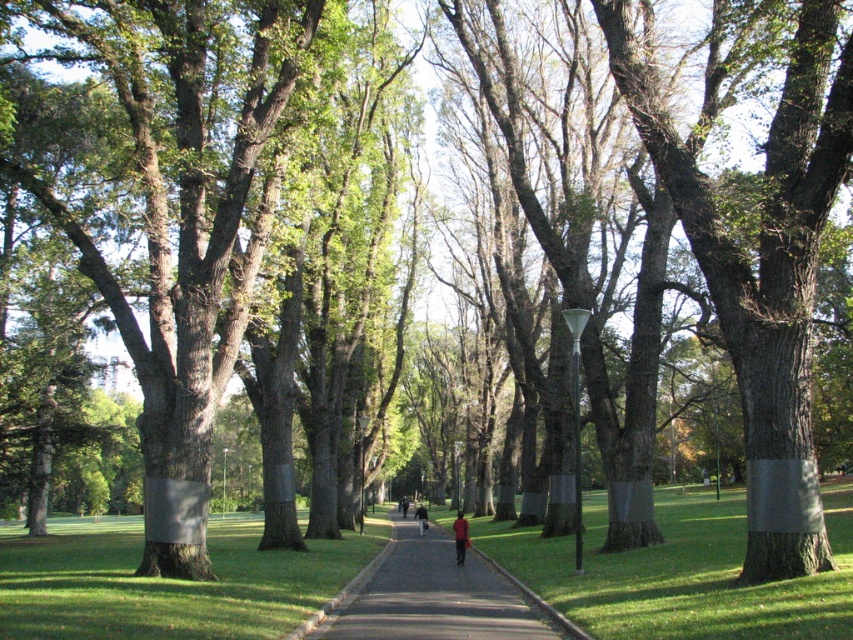
You are standing at the starting point of the pathway in the park. You want to walk towards the distant people. Which point, point (460,561) or point (422,531), will you reach first?

Point (460,561) is closer to the viewer than point (422,531), so you will reach point (460,561) first.

You are standing at the center of the park pathway. You see a smooth gray bark and a red shirt both at the center. If you want to reach the red shirt at center quickly, should you walk towards the smooth gray bark at center or away from it?

The smooth gray bark at center is 27.13 meters away from the red shirt at center. Since both are at the center, walking towards the smooth gray bark at center would mean moving away from the red shirt at center. Therefore, to reach the red shirt at center quickly, you should walk away from the smooth gray bark at center.

You are standing at the starting point of the pathway in the park. You notice two points marked on the path ahead of you. The first point is at coordinates point (607, 22) and the second is at point (456, 561). Which of these two points is closer to your current position?

Point (607, 22) is closer to the camera than point (456, 561), so the first point is closer to your current position.